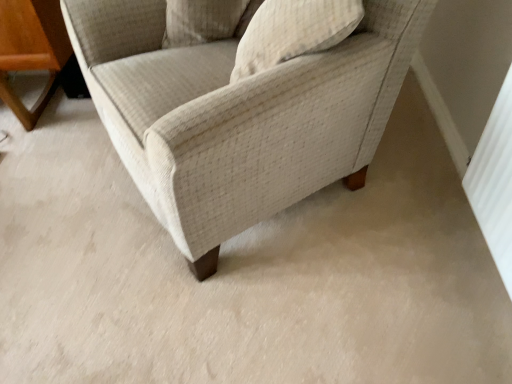
Image resolution: width=512 pixels, height=384 pixels. Identify the location of free region on the left part of beige fabric chair at center. (69, 201).